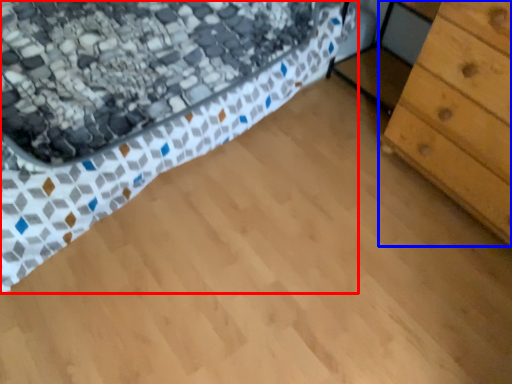
Question: Which point is further to the camera, bed (highlighted by a red box) or chest of drawers (highlighted by a blue box)?

Choices:
 (A) bed
 (B) chest of drawers

Answer: (B)